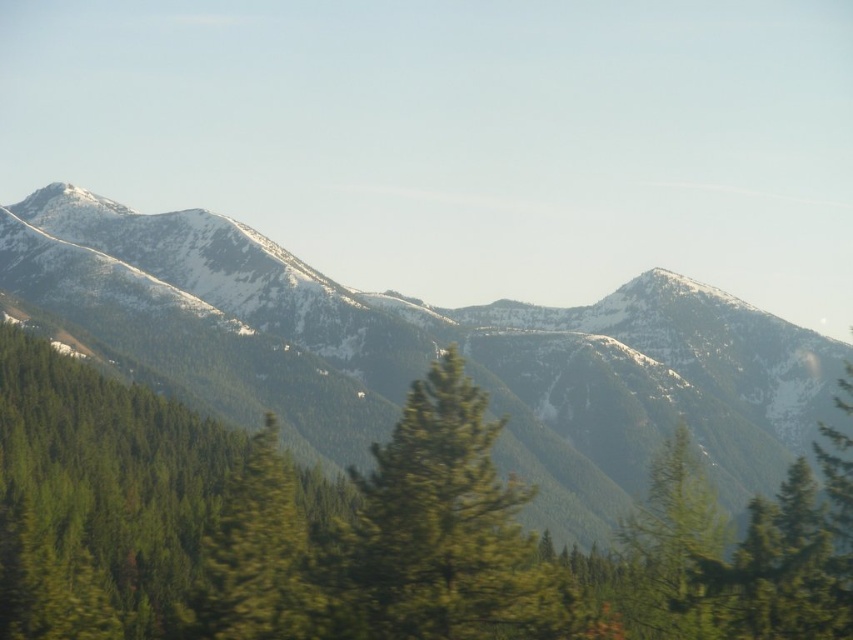
You are an environmental scientist studying the growth patterns of trees in mountainous regions. You observe two trees in the scene, the green textured tree at center and the green matte tree at center. Which tree is taller?

The green textured tree at center is taller than the green matte tree at center according to the description.

You are a hiker standing at the base of the mountain and looking at the green textured tree at center and the green matte tree at center. Which tree is higher up the mountain?

The green textured tree at center is higher up the mountain than the green matte tree at center because it is located above it in the scene.